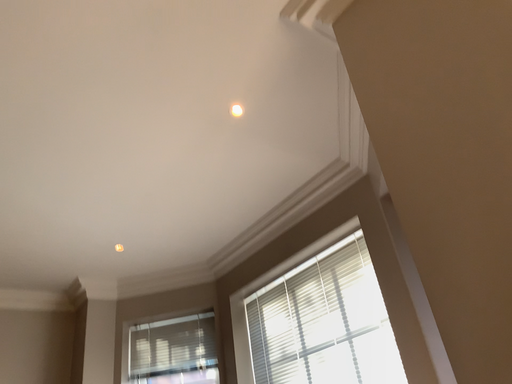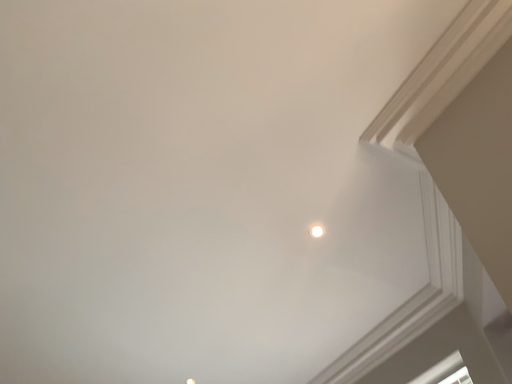
Question: Which way did the camera rotate in the video?

Choices:
 (A) rotated upward
 (B) rotated downward

Answer: (A)